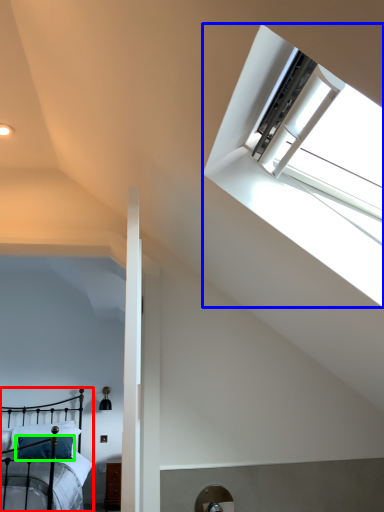
Question: Based on their relative distances, which object is nearer to bed (highlighted by a red box)? Choose from window (highlighted by a blue box) and pillow (highlighted by a green box).

Choices:
 (A) window
 (B) pillow

Answer: (B)